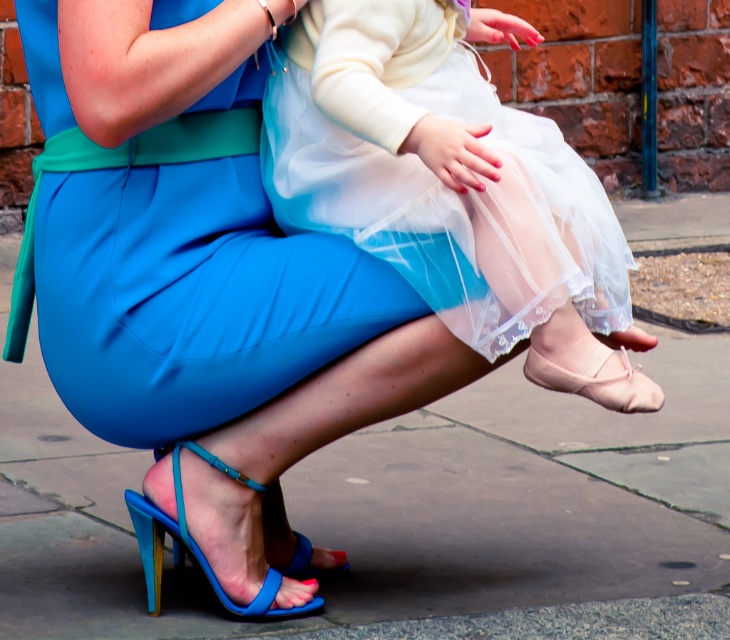
Question: Is blue glossy sandal at lower left above pink satin ballet shoe at lower center?

Choices:
 (A) yes
 (B) no

Answer: (B)

Question: Considering the real-world distances, which object is farthest from the white sheer dress at center?

Choices:
 (A) blue glossy sandal at lower left
 (B) pink satin ballet shoe at lower center

Answer: (A)

Question: Is white sheer dress at center positioned behind pink satin ballet shoe at lower center?

Choices:
 (A) yes
 (B) no

Answer: (B)

Question: Does white sheer dress at center have a lesser width compared to blue glossy sandal at lower left?

Choices:
 (A) yes
 (B) no

Answer: (B)

Question: Which point is closer to the camera?

Choices:
 (A) pink satin ballet shoe at lower center
 (B) white sheer dress at center
 (C) blue glossy sandal at lower left

Answer: (B)

Question: Which of the following is the farthest from the observer?

Choices:
 (A) pink satin ballet shoe at lower center
 (B) blue glossy sandal at lower left

Answer: (B)